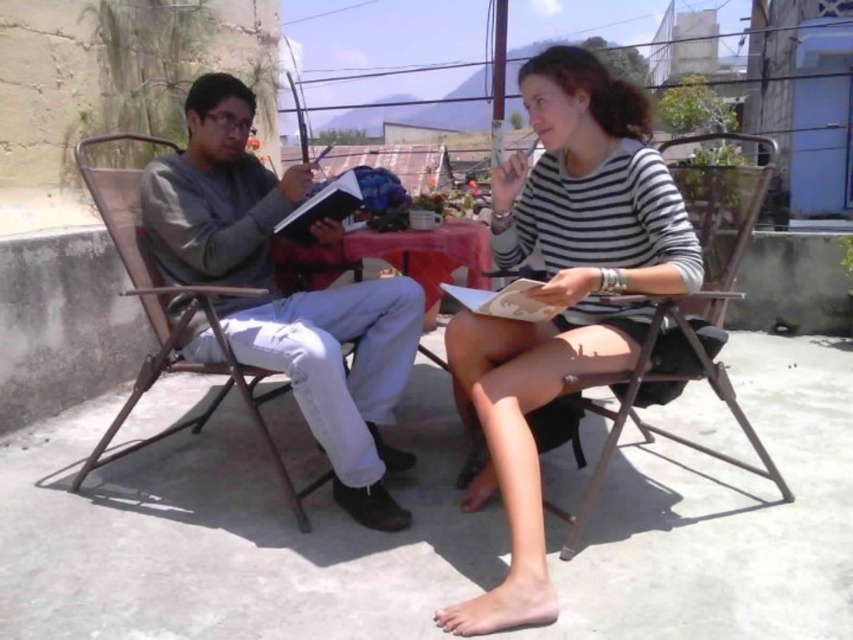
You are a fashion designer observing the rooftop terrace scene. You need to determine which item has a greater width between the light gray sweater at left and the metallic silver chair at center. Based on the scene, which one is wider?

The light gray sweater at left is wider than the metallic silver chair at center according to the description.

You are standing on the rooftop terrace and want to hand a book to the person wearing the matte gray sweater at upper left. Which direction should you move relative to the white striped shirt at center to reach them?

The matte gray sweater at upper left is below the white striped shirt at center, so you should move downward from the white striped shirt at center to reach the matte gray sweater at upper left.

Based on the scene description, where is the light gray sweater at left located in terms of its 2D coordinates?

The light gray sweater at left is located at the 2D coordinates of point (283, 296).